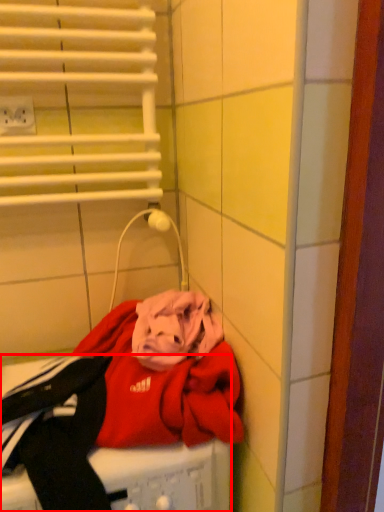
Question: Considering the relative positions of washing machine (annotated by the red box) and electric outlet in the image provided, where is washing machine (annotated by the red box) located with respect to the staircase?

Choices:
 (A) right
 (B) left

Answer: (A)